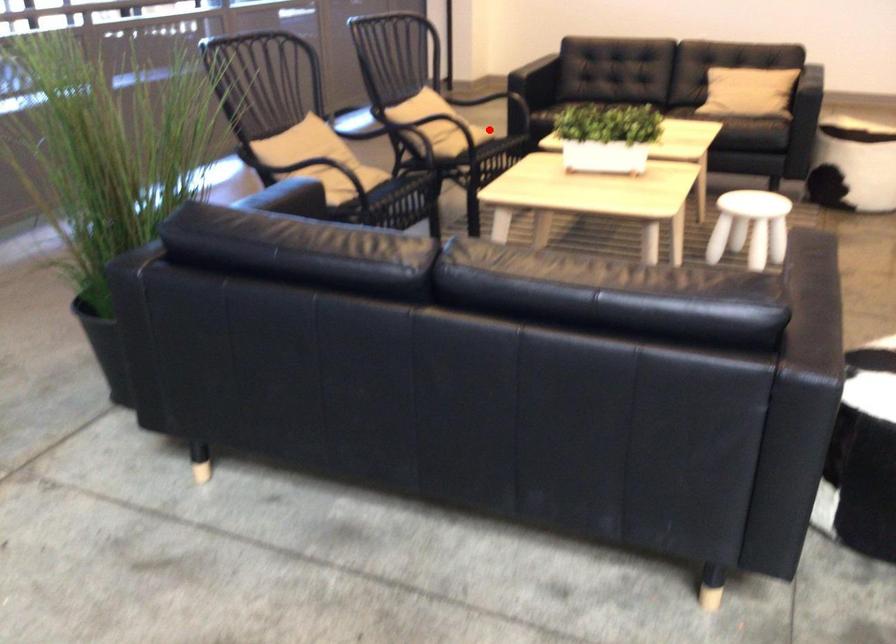
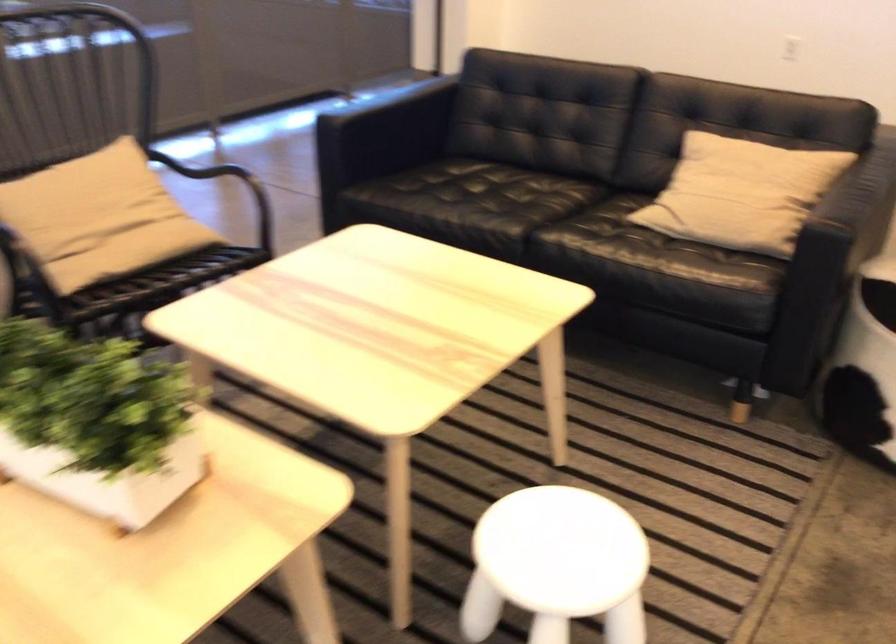
In the second image, find the point that corresponds to the highlighted location in the first image.

(151, 254)